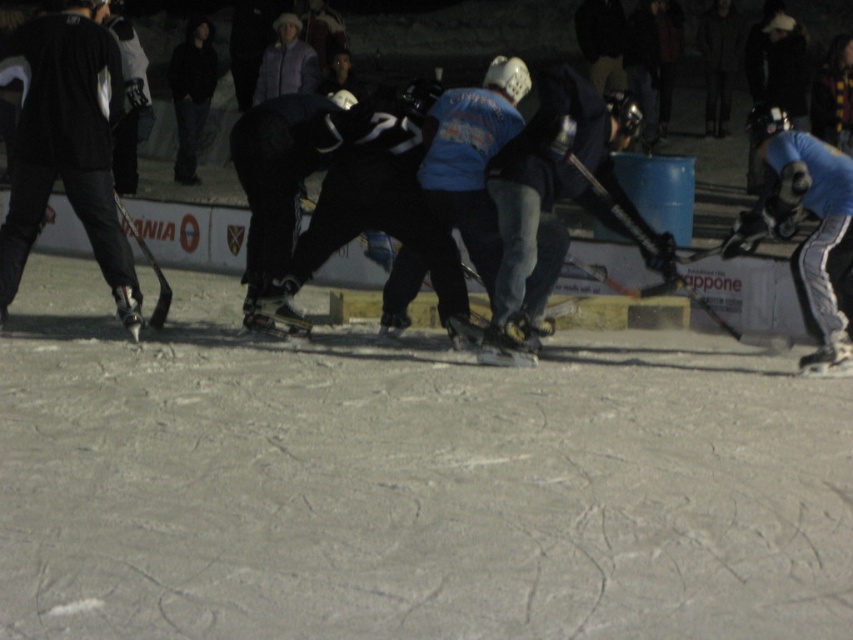
You are a referee at the ice hockey game. You need to determine if the black matte pants at left can fit through a gap that is exactly the width of the wooden hockey stick at center. Can they?

The black matte pants at left has a lesser width compared to the wooden hockey stick at center, so yes, the black matte pants at left can fit through the gap since it is narrower than the wooden hockey stick at center.

In the scene shown: You are a photographer standing at the camera position capturing this ice hockey scene. You want to place a small sticker exactly at the point labeled as point (131, 332). If the sticker has a diameter of 10 centimeters, will it be large enough to be visible in the photo?

The point (131, 332) is 8.47 meters away from the camera. A sticker with a diameter of 10 centimeters placed at this distance might be too small to be clearly visible in the photo due to its distance from the camera.